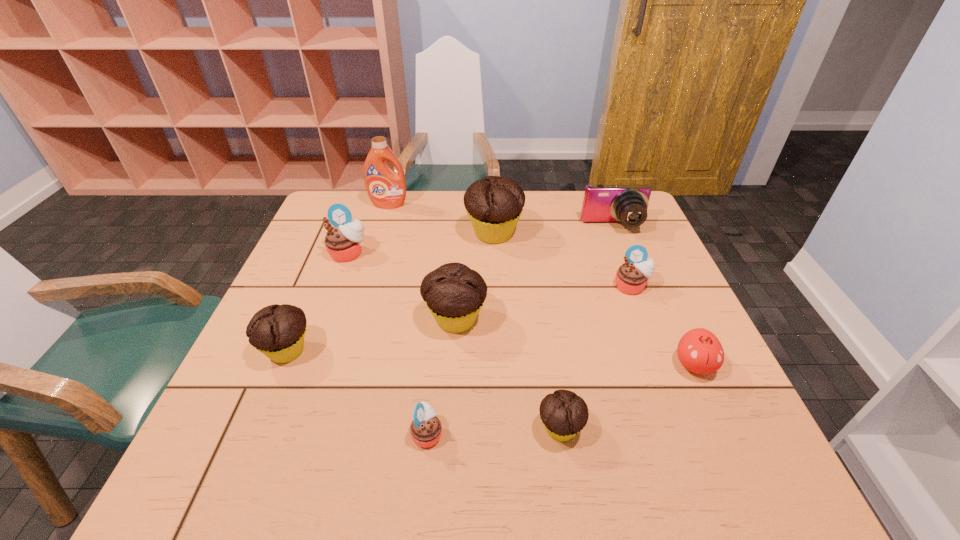
Where is `the farthest object`? The image size is (960, 540). the farthest object is located at coordinates [x=386, y=188].

At what (x,y) coordinates should I click in order to perform the action: click on detergent. Please return your answer as a coordinate pair (x, y). The image size is (960, 540). Looking at the image, I should click on (386, 188).

Where is `the farthest chocolate muffin`? The height and width of the screenshot is (540, 960). the farthest chocolate muffin is located at coordinates (494, 204).

At what (x,y) coordinates should I click in order to perform the action: click on the leftmost pink muffin. Please return your answer as a coordinate pair (x, y). This screenshot has width=960, height=540. Looking at the image, I should click on (343, 242).

Identify the location of the farthest pink muffin. (343, 242).

Locate an element on the screen. the third smallest chocolate muffin is located at coordinates (454, 293).

What are the coordinates of `camera` in the screenshot? It's located at (628, 204).

Find the location of a particular element. the sixth nearest object is located at coordinates (631, 277).

The width and height of the screenshot is (960, 540). I want to click on the second biggest pink muffin, so click(631, 277).

This screenshot has height=540, width=960. I want to click on the leftmost chocolate muffin, so click(278, 331).